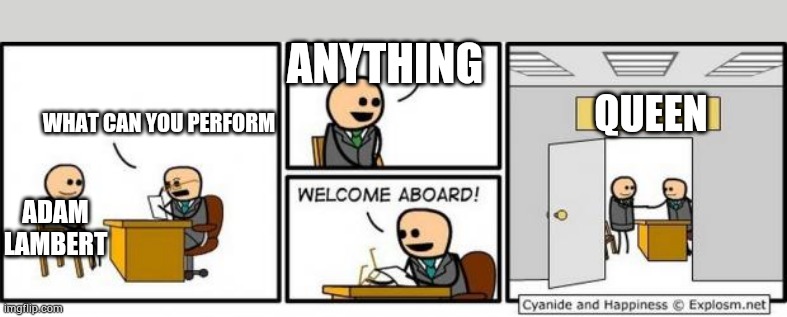
Locate an element on the screen. office chair is located at coordinates (216, 221), (482, 271).